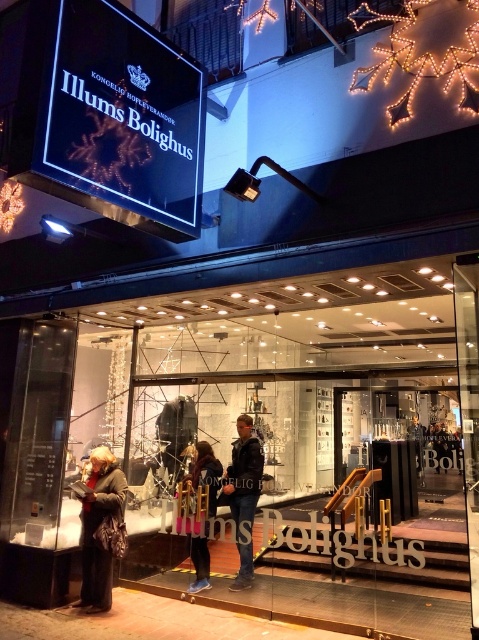
Question: Observing the image, what is the correct spatial positioning of leather jacket at lower left in reference to denim jacket at center?

Choices:
 (A) below
 (B) above

Answer: (B)

Question: Is leather jacket at lower left further to camera compared to denim jacket at center?

Choices:
 (A) no
 (B) yes

Answer: (A)

Question: Which point appears farthest from the camera in this image?

Choices:
 (A) (239, 518)
 (B) (102, 452)
 (C) (203, 582)

Answer: (C)

Question: Which point is farther to the camera?

Choices:
 (A) denim jacket at center
 (B) dark blue jeans at center

Answer: (A)

Question: Which object appears farthest from the camera in this image?

Choices:
 (A) denim jacket at center
 (B) leather jacket at lower left

Answer: (A)

Question: In this image, where is dark blue jeans at center located relative to denim jacket at center?

Choices:
 (A) left
 (B) right

Answer: (B)